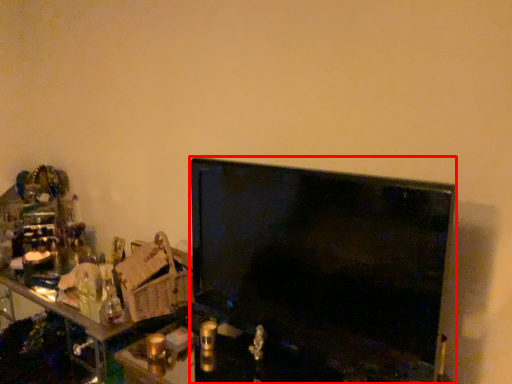
Question: Where is television (annotated by the red box) located in relation to computer in the image?

Choices:
 (A) left
 (B) right

Answer: (B)